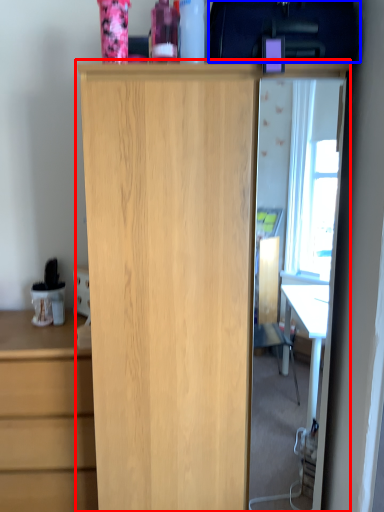
Question: Which of the following is the closest to the observer, cupboard (highlighted by a red box) or back (highlighted by a blue box)?

Choices:
 (A) cupboard
 (B) back

Answer: (B)